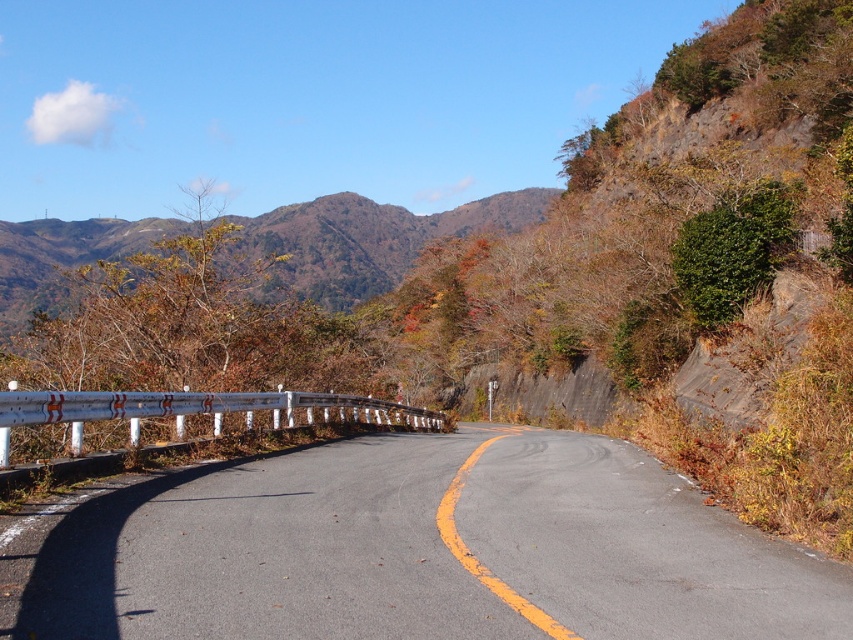
Question: Does asphalt road at center have a smaller size compared to brown textured mountain at upper center?

Choices:
 (A) yes
 (B) no

Answer: (A)

Question: In this image, where is asphalt road at center located relative to brown textured mountain at upper center?

Choices:
 (A) above
 (B) below

Answer: (B)

Question: Which point is closer to the camera?

Choices:
 (A) brown textured mountain at upper center
 (B) asphalt road at center

Answer: (B)

Question: Does asphalt road at center have a larger size compared to brown textured mountain at upper center?

Choices:
 (A) no
 (B) yes

Answer: (A)

Question: Which point is closer to the camera?

Choices:
 (A) brown textured mountain at upper center
 (B) asphalt road at center

Answer: (B)